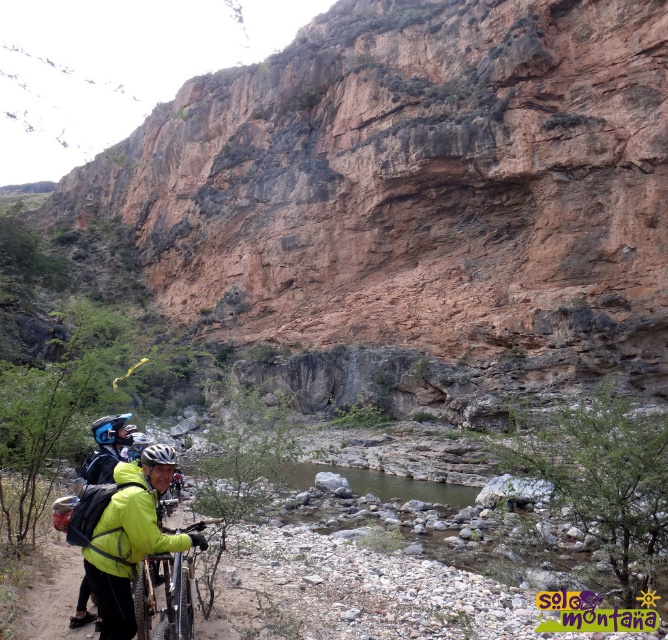
Question: Where is neon yellow jacket at center located in relation to shiny metallic bicycle at center in the image?

Choices:
 (A) above
 (B) below

Answer: (A)

Question: Can you confirm if neon yellow jacket at center is thinner than shiny metallic bicycle at center?

Choices:
 (A) yes
 (B) no

Answer: (B)

Question: Can you confirm if neon yellow jacket at center is bigger than shiny metallic bicycle at center?

Choices:
 (A) no
 (B) yes

Answer: (A)